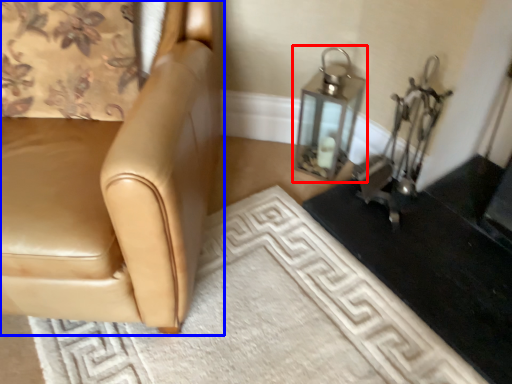
Question: Which of the following is the closest to the observer, oil lamp (highlighted by a red box) or chair (highlighted by a blue box)?

Choices:
 (A) oil lamp
 (B) chair

Answer: (B)